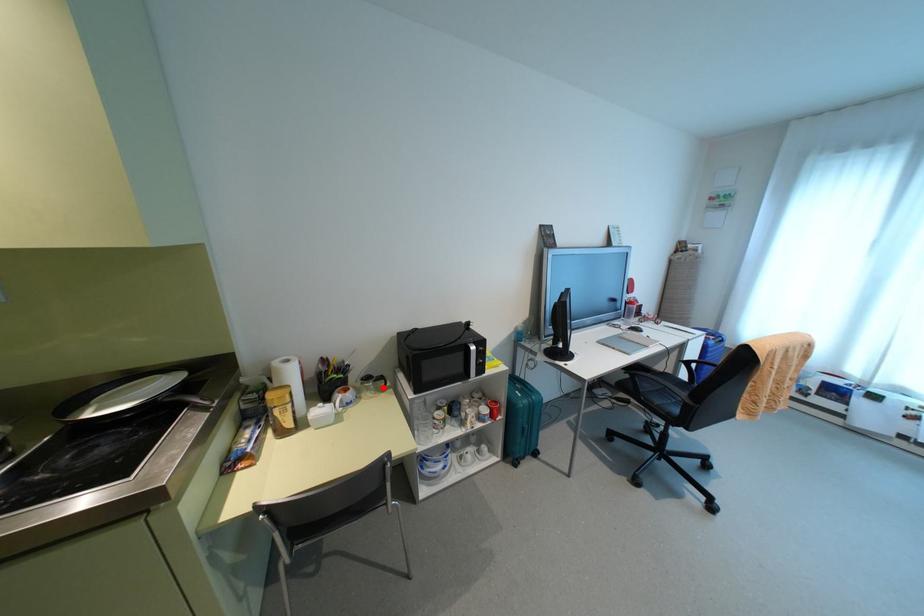
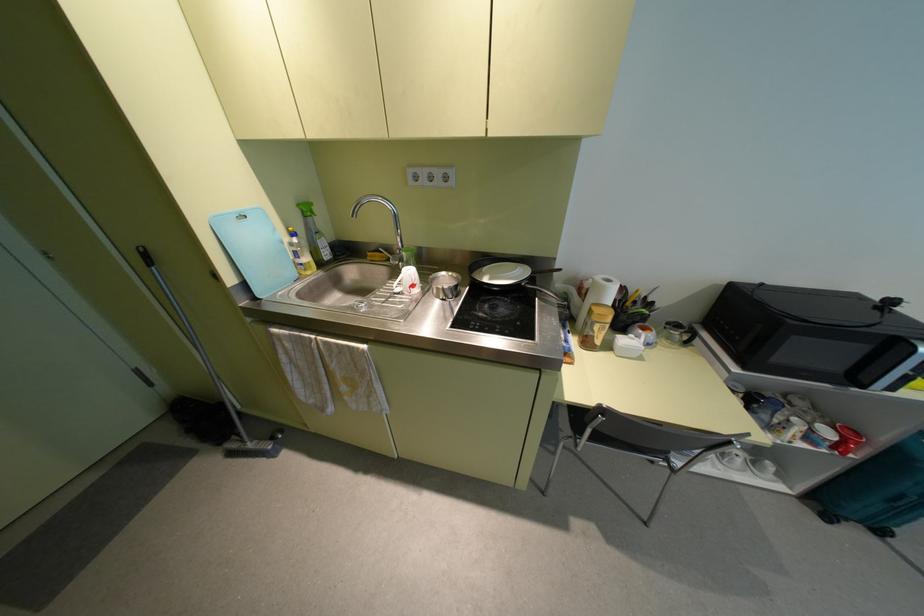
Where in the second image is the point corresponding to the highlighted location from the first image?

(686, 342)